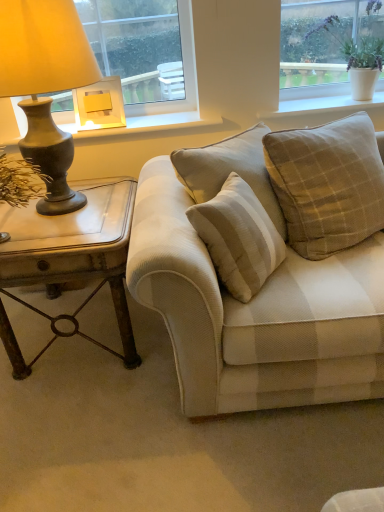
This screenshot has height=512, width=384. What are the coordinates of `free space above matte wood window sill at upper center (from a real-world perspective)` in the screenshot? It's located at pyautogui.click(x=132, y=118).